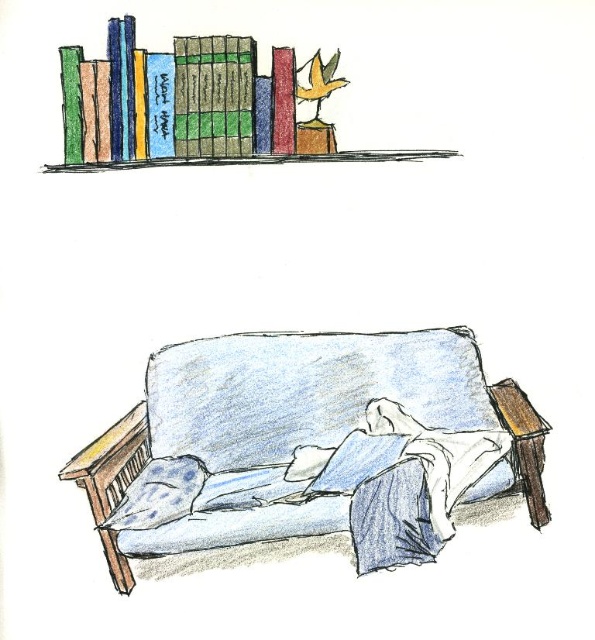
You are sitting on the blue fabric couch at center and want to place a small book on the blue dotted pillow at lower left. Can you reach the pillow from your current position?

The blue fabric couch at center is positioned over the blue dotted pillow at lower left, meaning the couch is directly above the pillow. Since the couch is above the pillow, you cannot physically reach the pillow from the couch as they are in different vertical planes.

You are a librarian who needs to place a new book that is 12 inches wide on the shelf. Can the space between the matte green book at upper left and the orange matte bird at upper center accommodate this new book?

The space between the matte green book at upper left and the orange matte bird at upper center is 13.44 inches, which is wider than the new book that is 12 inches wide. Therefore, the space can accommodate the new book.

You are sitting on the blue fabric couch at center and want to place a book from the bookshelf onto the blue dotted pillow at lower left. Can the book fit on the pillow if the book is 10 cm tall?

The blue fabric couch at center is taller than the blue dotted pillow at lower left, but the height of the pillow isn